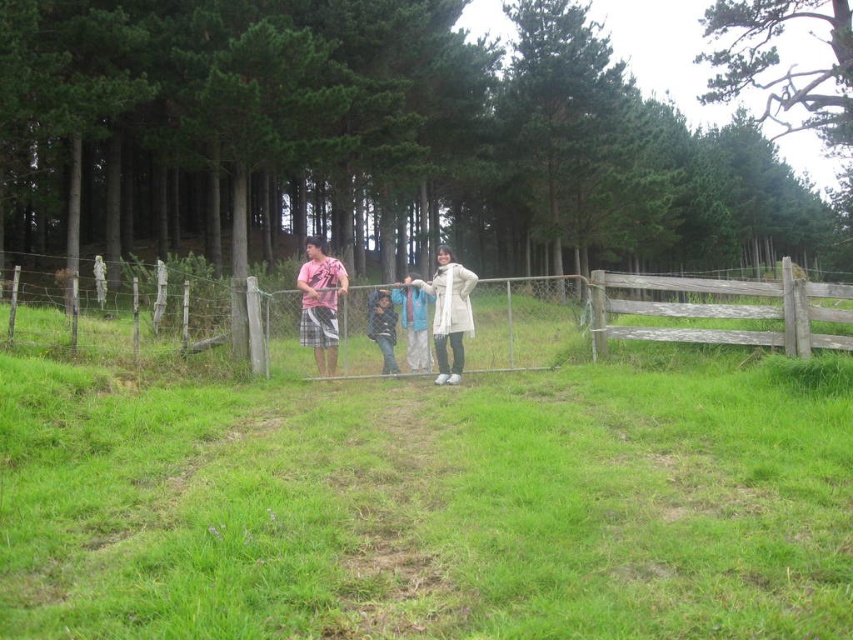
You are a photographer trying to capture a clear shot of the matte pink shirt at center and the white woolen coat at center. Based on their positions, which one is more likely to be in focus if you focus on the person at the center of the frame?

The matte pink shirt at center is more likely to be in focus because it is positioned above the white woolen coat at center, meaning it is closer to the camera.

You are a photographer setting up a tripod to capture a group photo of the scene. The tripod requires a minimum distance of 2 meters between the weathered wood fence at right and the dark blue denim jeans at center to ensure proper framing. Based on the scene description, will the current positioning allow you to set up the tripod as planned?

The weathered wood fence at right is 1.95 meters away from the dark blue denim jeans at center, which is less than the required 2 meters. Therefore, the current positioning does not allow for proper tripod setup as planned.